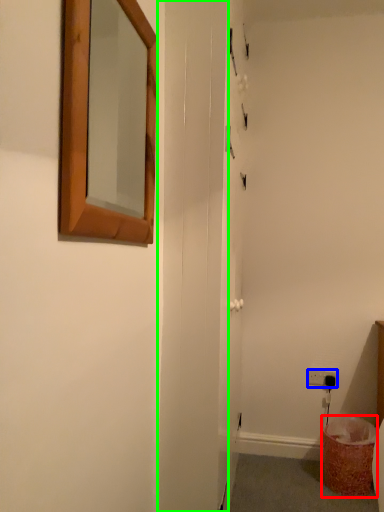
Question: Considering the real-world distances, which object is closest to laundry basket (highlighted by a red box)? electric outlet (highlighted by a blue box) or screen door (highlighted by a green box).

Choices:
 (A) electric outlet
 (B) screen door

Answer: (A)